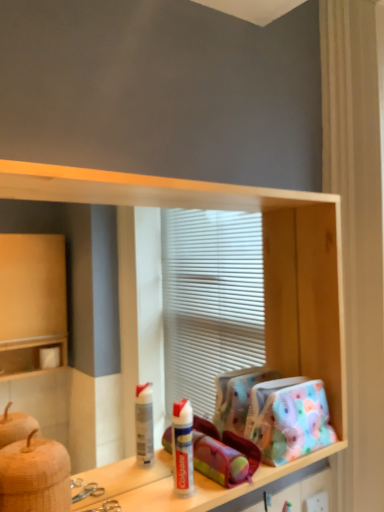
The image size is (384, 512). What do you see at coordinates (264, 283) in the screenshot?
I see `wooden shelf at center` at bounding box center [264, 283].

Where is `wooden shelf at center`? This screenshot has height=512, width=384. wooden shelf at center is located at coordinates (264, 283).

Locate an element on the screen. The height and width of the screenshot is (512, 384). wooden shelf at center is located at coordinates (264, 283).